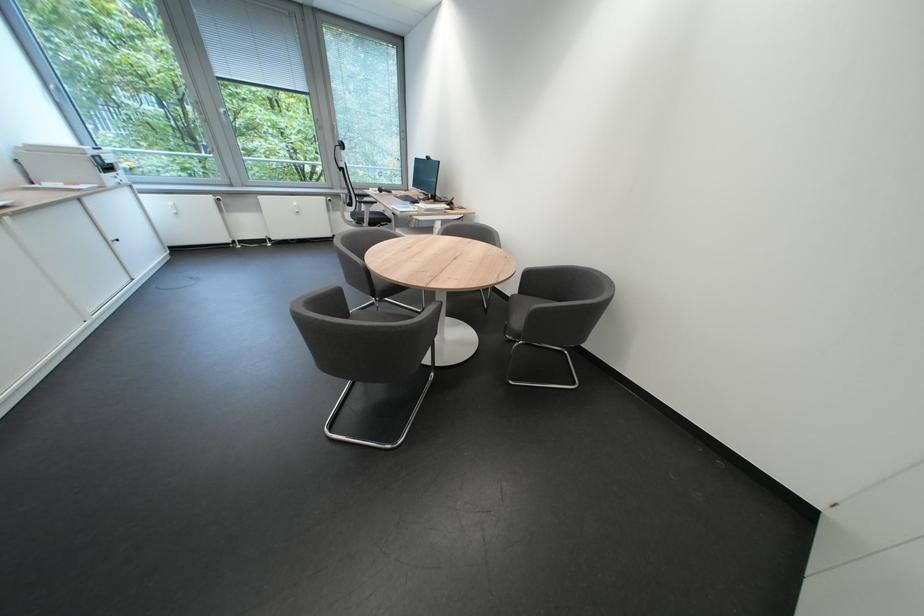
The height and width of the screenshot is (616, 924). I want to click on black office chair sitting surface, so click(369, 216).